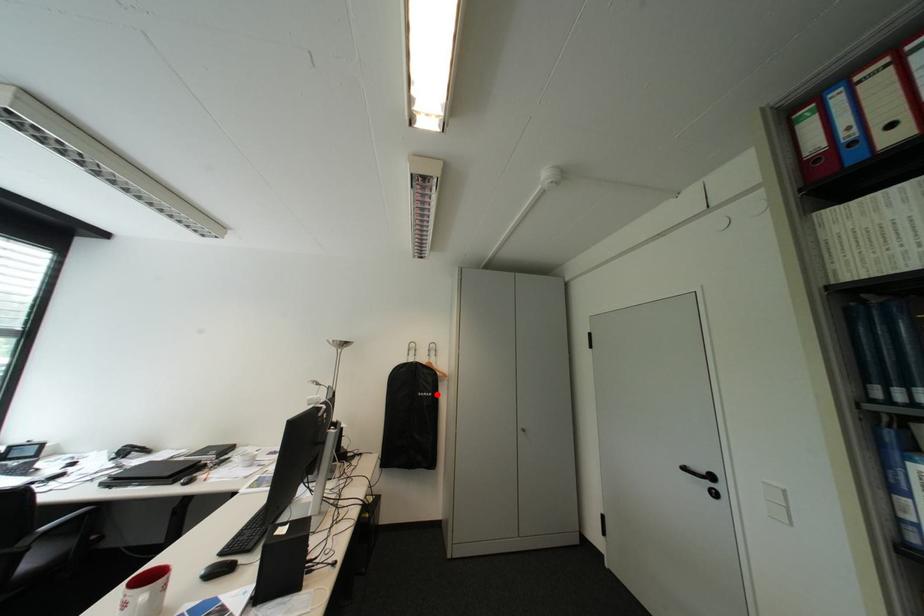
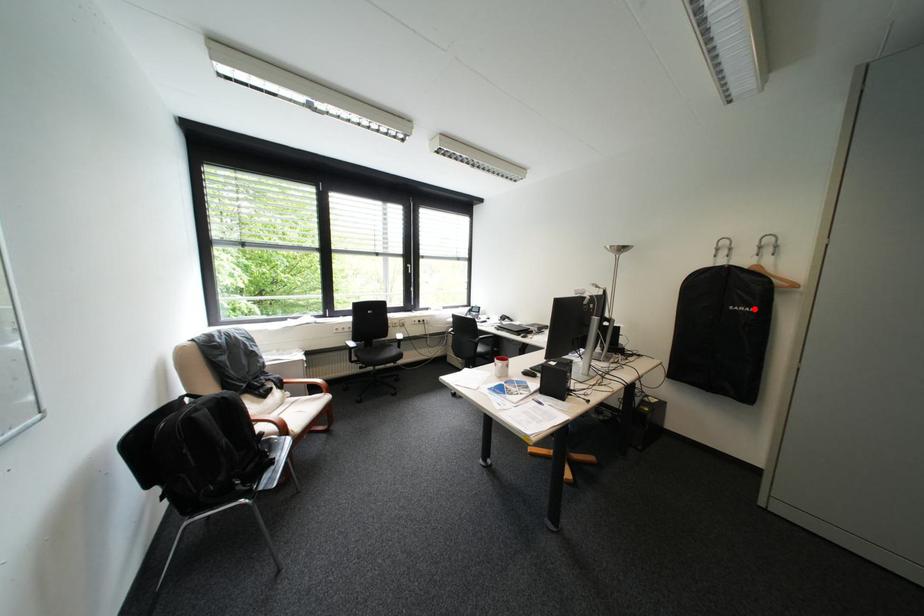
I am providing you with two images of the same scene from different viewpoints. A red point is marked on the first image and another point is marked on the second image. Is the marked point in image1 the same physical position as the marked point in image2?

Yes